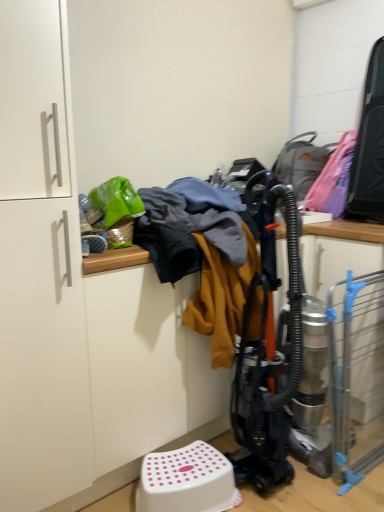
Question: From a real-world perspective, does green plastic basket at upper left stand above green plastic bag at upper left?

Choices:
 (A) yes
 (B) no

Answer: (B)

Question: From the image's perspective, is green plastic basket at upper left above green plastic bag at upper left?

Choices:
 (A) yes
 (B) no

Answer: (B)

Question: Is green plastic basket at upper left facing towards green plastic bag at upper left?

Choices:
 (A) yes
 (B) no

Answer: (B)

Question: From a real-world perspective, does green plastic basket at upper left sit lower than green plastic bag at upper left?

Choices:
 (A) no
 (B) yes

Answer: (B)

Question: Considering the relative sizes of green plastic basket at upper left and green plastic bag at upper left in the image provided, is green plastic basket at upper left taller than green plastic bag at upper left?

Choices:
 (A) yes
 (B) no

Answer: (B)

Question: From a real-world perspective, is green plastic basket at upper left physically located above or below white plastic step stool at lower center?

Choices:
 (A) above
 (B) below

Answer: (A)

Question: Relative to white plastic step stool at lower center, is green plastic basket at upper left in front or behind?

Choices:
 (A) behind
 (B) front

Answer: (A)

Question: Looking at the image, does green plastic basket at upper left seem bigger or smaller compared to white plastic step stool at lower center?

Choices:
 (A) small
 (B) big

Answer: (A)

Question: Looking at their shapes, would you say green plastic basket at upper left is wider or thinner than white plastic step stool at lower center?

Choices:
 (A) wide
 (B) thin

Answer: (B)

Question: Considering the positions of white matte cabinet at left and green plastic basket at upper left in the image, is white matte cabinet at left taller or shorter than green plastic basket at upper left?

Choices:
 (A) short
 (B) tall

Answer: (B)

Question: Is point (38, 164) closer or farther from the camera than point (122, 227)?

Choices:
 (A) closer
 (B) farther

Answer: (A)

Question: In terms of width, does white matte cabinet at left look wider or thinner when compared to green plastic basket at upper left?

Choices:
 (A) thin
 (B) wide

Answer: (B)

Question: Considering the positions of white matte cabinet at left and green plastic basket at upper left in the image, is white matte cabinet at left bigger or smaller than green plastic basket at upper left?

Choices:
 (A) big
 (B) small

Answer: (A)

Question: Is white plastic step stool at lower center wider or thinner than green plastic bag at upper left?

Choices:
 (A) wide
 (B) thin

Answer: (B)

Question: From a real-world perspective, is white plastic step stool at lower center physically located above or below green plastic bag at upper left?

Choices:
 (A) above
 (B) below

Answer: (B)